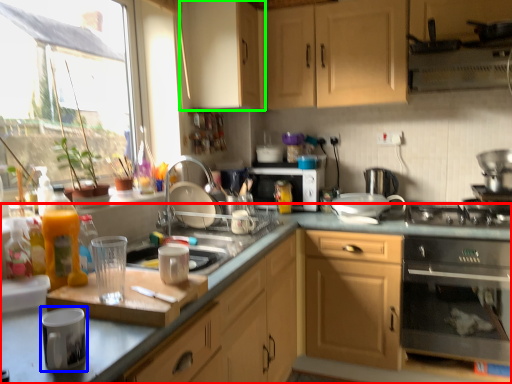
Question: Based on their relative distances, which object is farther from cabinetry (highlighted by a red box)? Choose from appliance (highlighted by a blue box) and cabinetry (highlighted by a green box).

Choices:
 (A) appliance
 (B) cabinetry

Answer: (B)